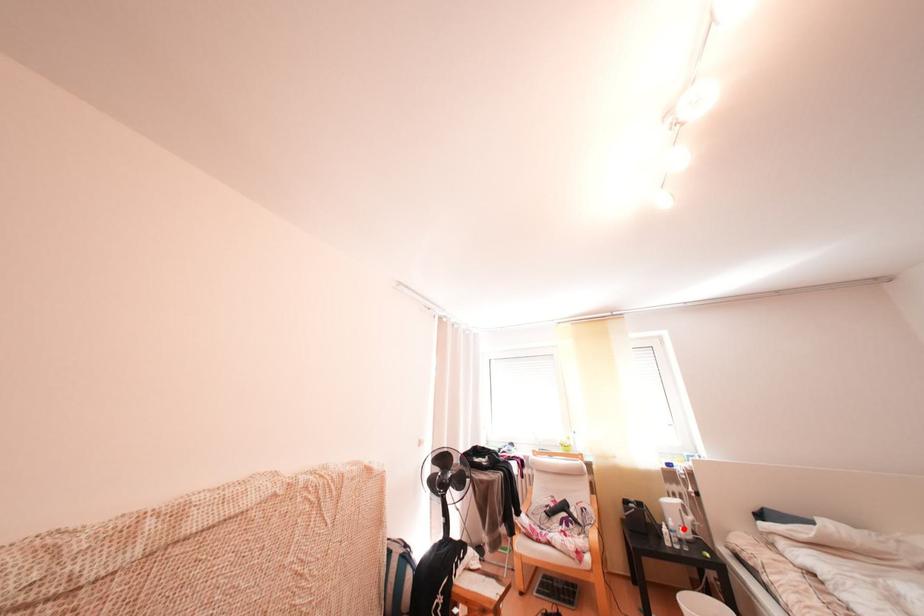
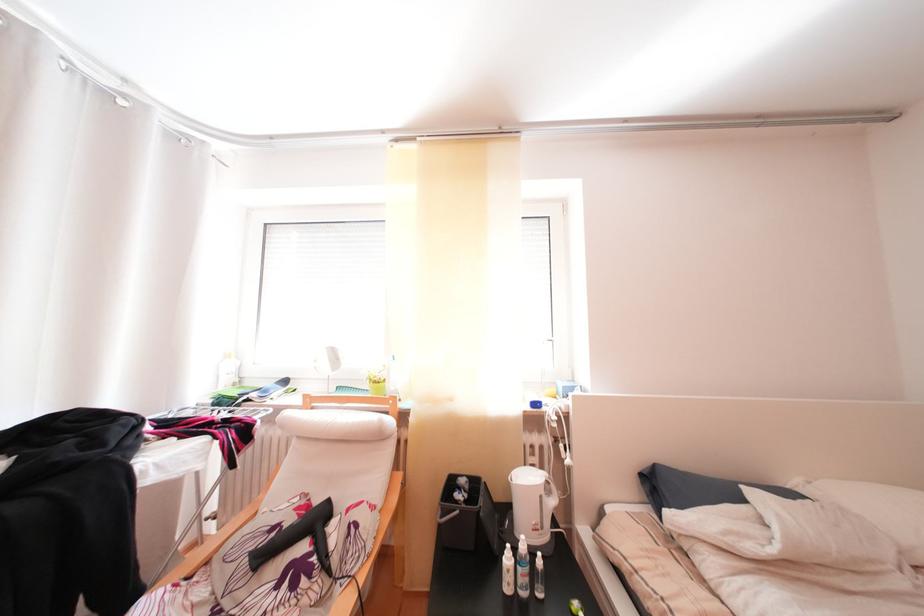
Question: I am providing you with two images of the same scene from different viewpoints. Image1 has a red point marked. In image2, the corresponding 3D location appears at what relative position? Reply with the corresponding letter.

Choices:
 (A) Closer
 (B) Farther

Answer: (A)